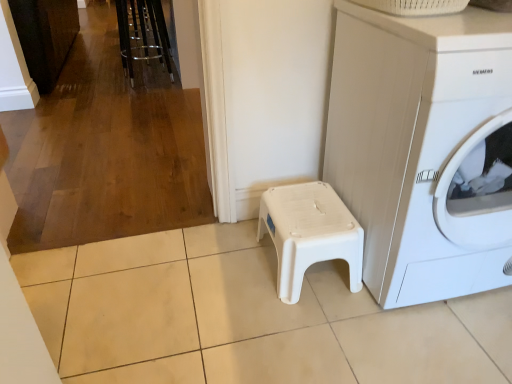
Where is `free space to the left of white plastic washing machine at lower right`? This screenshot has width=512, height=384. free space to the left of white plastic washing machine at lower right is located at coordinates click(x=248, y=297).